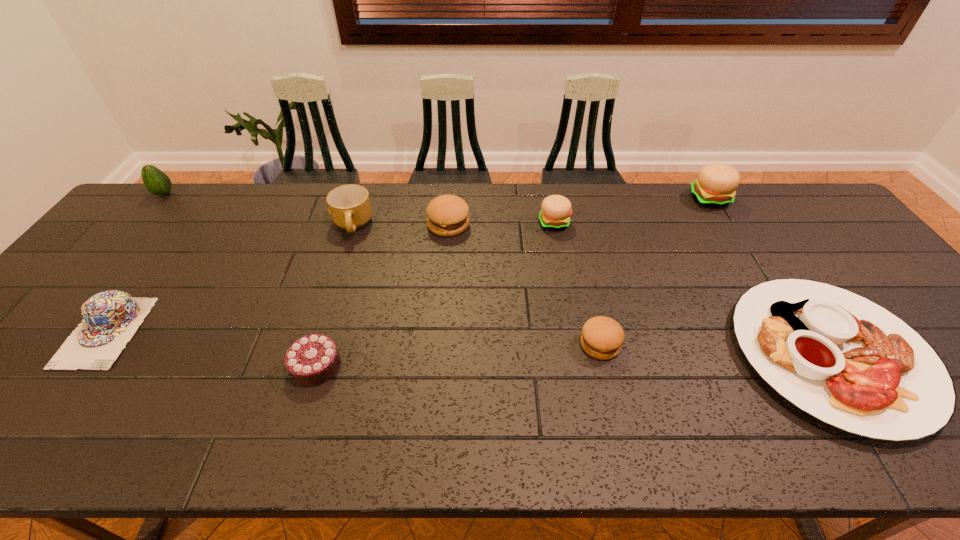
Find the location of a particular element. The width and height of the screenshot is (960, 540). empty location between the mug and the farther brown hamburger is located at coordinates (400, 225).

Identify the location of free space between the smaller brown hamburger and the eighth object from right to left. This screenshot has width=960, height=540. (353, 338).

Identify the location of vacant space that's between the right beige hamburger and the chocolate cake. tap(514, 282).

Locate an element on the screen. free area in between the bigger brown hamburger and the chocolate cake is located at coordinates (382, 295).

Find the location of a particular element. free point between the avocado and the tallest hamburger is located at coordinates (438, 197).

The height and width of the screenshot is (540, 960). I want to click on vacant space that is in between the nearer brown hamburger and the leftmost object, so click(382, 269).

Point out which object is positioned as the fifth nearest to the left beige hamburger. Please provide its 2D coordinates. Your answer should be formatted as a tuple, i.e. [(x, y)], where the tuple contains the x and y coordinates of a point satisfying the conditions above.

[(350, 208)]

The width and height of the screenshot is (960, 540). What are the coordinates of `object that can be found as the closest to the mug` in the screenshot? It's located at (447, 214).

Locate an element on the screen. The width and height of the screenshot is (960, 540). the fourth closest hamburger to the avocado is located at coordinates (716, 184).

Where is `the fourth closest hamburger to the mug`? the fourth closest hamburger to the mug is located at coordinates (716, 184).